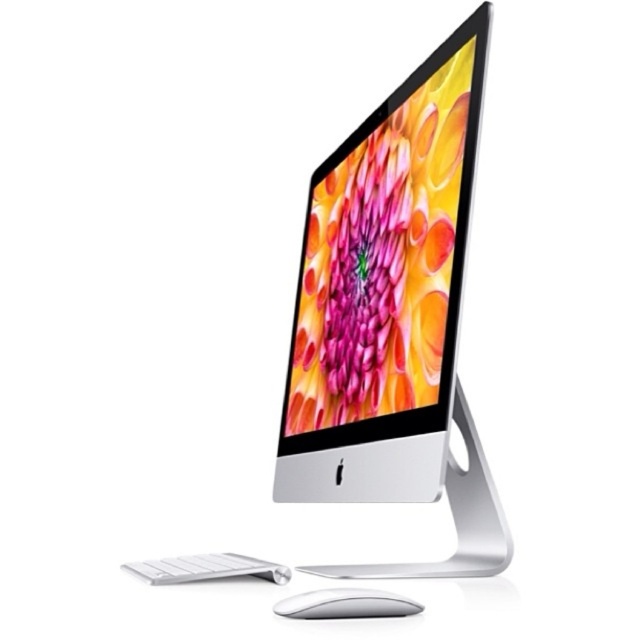
Question: Can you confirm if silver metallic desktop computer at center is positioned above silver metallic mouse at lower center?

Choices:
 (A) yes
 (B) no

Answer: (A)

Question: Is silver metallic computer monitor at center further to camera compared to white matte keyboard at lower left?

Choices:
 (A) no
 (B) yes

Answer: (A)

Question: Is white matte keyboard at lower left smaller than silver metallic mouse at lower center?

Choices:
 (A) no
 (B) yes

Answer: (A)

Question: Among these objects, which one is farthest from the camera?

Choices:
 (A) silver metallic mouse at lower center
 (B) silver metallic computer monitor at center
 (C) silver metallic desktop computer at center

Answer: (B)

Question: Among these objects, which one is farthest from the camera?

Choices:
 (A) white matte keyboard at lower left
 (B) silver metallic computer monitor at center
 (C) silver metallic mouse at lower center

Answer: (A)

Question: Which object is closer to the camera taking this photo?

Choices:
 (A) silver metallic computer monitor at center
 (B) white matte keyboard at lower left
 (C) silver metallic mouse at lower center
 (D) silver metallic desktop computer at center

Answer: (C)